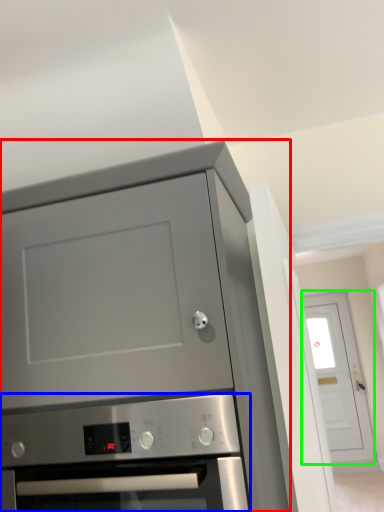
Question: Based on their relative distances, which object is nearer to cabinetry (highlighted by a red box)? Choose from oven (highlighted by a blue box) and door (highlighted by a green box).

Choices:
 (A) oven
 (B) door

Answer: (A)